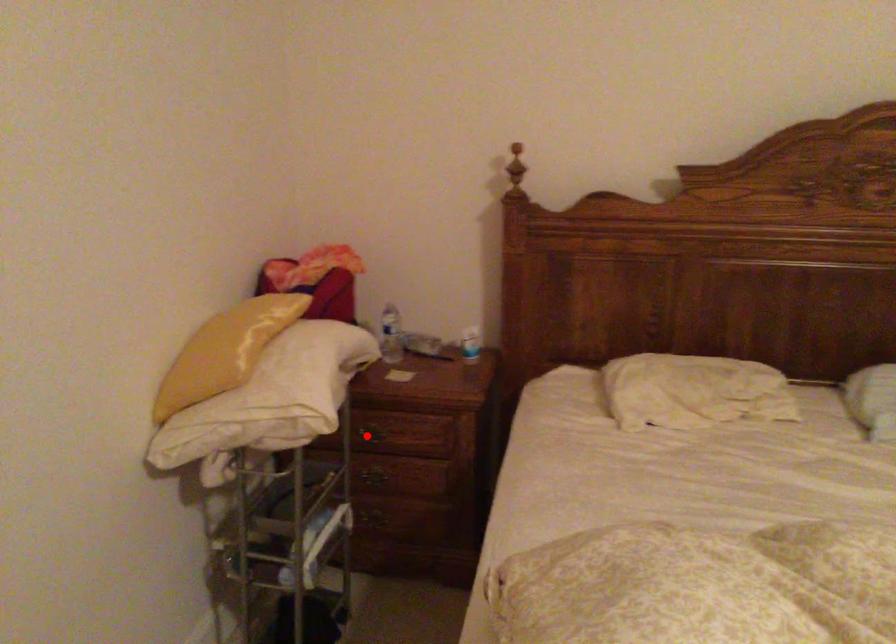
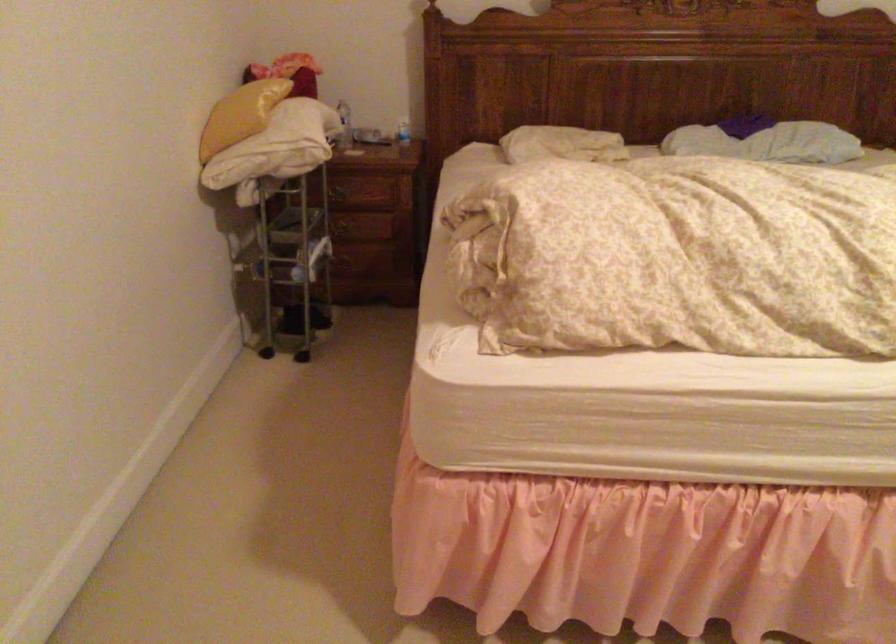
Question: A red point is marked in image1. In image2, is the corresponding 3D point closer to the camera or farther? Reply with the corresponding letter.

Choices:
 (A) The corresponding 3D point is closer.
 (B) The corresponding 3D point is farther.

Answer: (B)